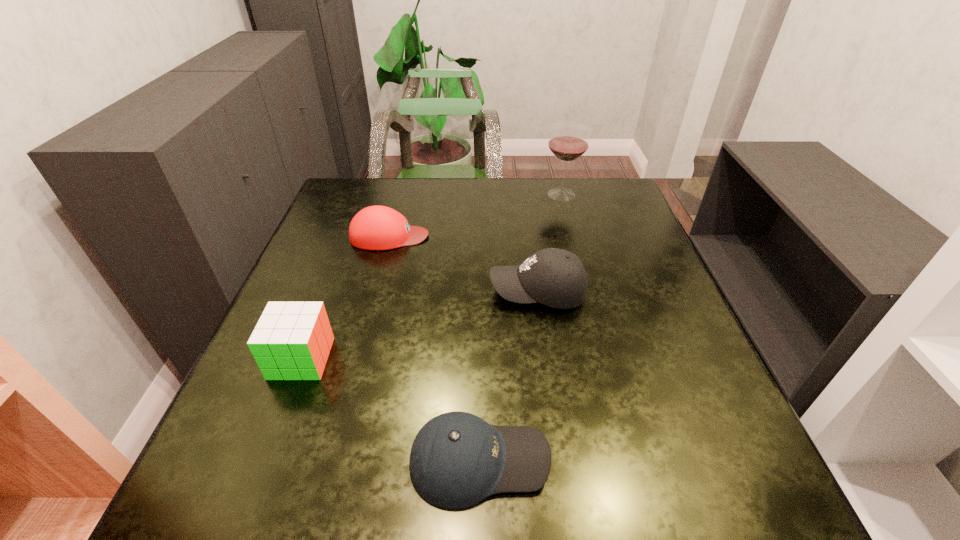
The width and height of the screenshot is (960, 540). I want to click on vacant space located on the front-facing side of the second nearest baseball cap, so click(x=313, y=292).

Where is `free location located on the front-facing side of the second nearest baseball cap`? This screenshot has width=960, height=540. free location located on the front-facing side of the second nearest baseball cap is located at coordinates tap(361, 292).

Identify the location of vacant space situated 0.180m on the back of the second nearest object. click(x=331, y=280).

The width and height of the screenshot is (960, 540). Find the location of `free spot located on the front-facing side of the leftmost baseball cap`. free spot located on the front-facing side of the leftmost baseball cap is located at coordinates (455, 236).

Find the location of `free region located on the front-facing side of the nearest object`. free region located on the front-facing side of the nearest object is located at coordinates (662, 461).

This screenshot has width=960, height=540. What are the coordinates of `object situated at the far edge` in the screenshot? It's located at (568, 141).

Where is `object present at the near edge`? The width and height of the screenshot is (960, 540). object present at the near edge is located at coordinates (457, 459).

Where is `cube located at the left edge`? This screenshot has height=540, width=960. cube located at the left edge is located at coordinates (292, 340).

This screenshot has height=540, width=960. What are the coordinates of `baseball cap at the left edge` in the screenshot? It's located at (377, 227).

Where is `object positioned at the right edge`? object positioned at the right edge is located at coordinates (568, 141).